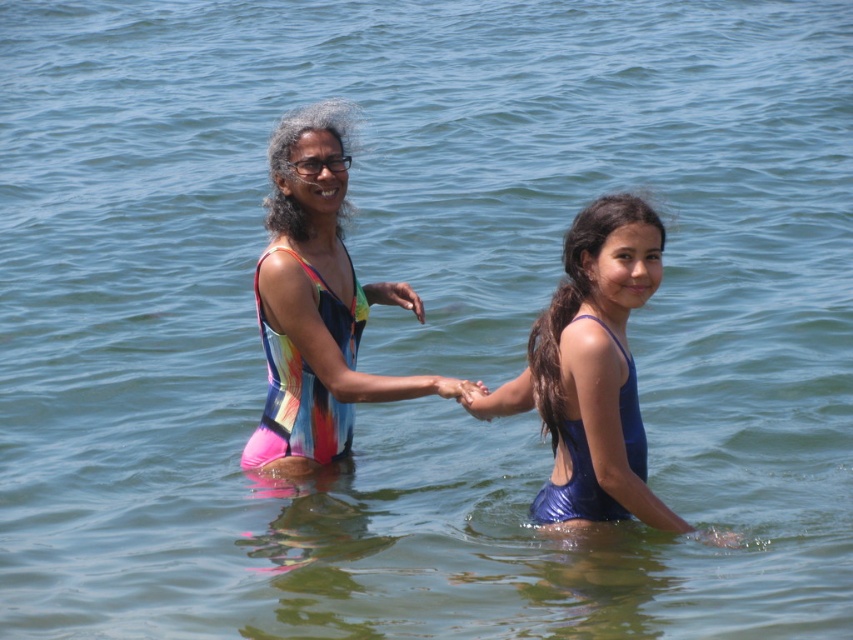
Question: Which is nearer to the matte blue swimsuit at center?

Choices:
 (A) matte plastic hand at center
 (B) matte skin hand at center
 (C) multicolored swimsuit at center
 (D) blue shiny swimsuit at center

Answer: (B)

Question: Observing the image, what is the correct spatial positioning of blue shiny swimsuit at center in reference to matte plastic hand at center?

Choices:
 (A) right
 (B) left

Answer: (A)

Question: Which is nearer to the matte blue swimsuit at center?

Choices:
 (A) matte plastic hand at center
 (B) matte skin hand at center

Answer: (B)

Question: From the image, what is the correct spatial relationship of blue shiny swimsuit at center in relation to matte plastic hand at center?

Choices:
 (A) above
 (B) below

Answer: (B)

Question: Estimate the real-world distances between objects in this image. Which object is farther from the matte skin hand at center?

Choices:
 (A) multicolored swimsuit at center
 (B) blue shiny swimsuit at center
 (C) matte blue swimsuit at center
 (D) matte plastic hand at center

Answer: (A)

Question: Is multicolored swimsuit at center to the left of matte plastic hand at center from the viewer's perspective?

Choices:
 (A) yes
 (B) no

Answer: (A)